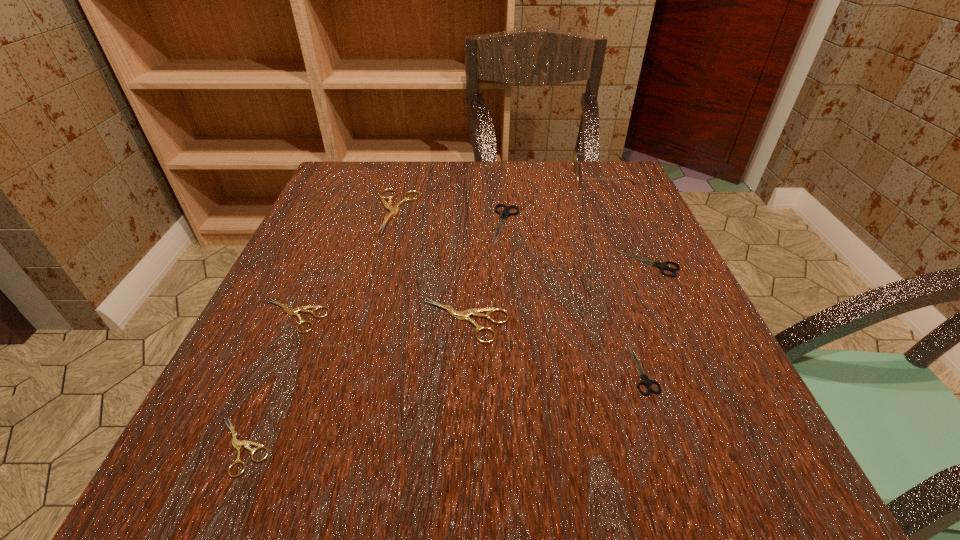
This screenshot has width=960, height=540. In order to click on free space at the far edge in this screenshot , I will do `click(460, 173)`.

Locate an element on the screen. free region at the near edge of the desktop is located at coordinates (583, 446).

I want to click on vacant space at the left edge, so click(300, 334).

Where is `free spot at the right edge of the desktop`? free spot at the right edge of the desktop is located at coordinates click(691, 302).

Where is `blank area at the far left corner`? The image size is (960, 540). blank area at the far left corner is located at coordinates (354, 171).

Identify the location of vacant space at the far right corner. This screenshot has width=960, height=540. (627, 173).

At what (x,y) coordinates should I click in order to perform the action: click on vacant space at the near right corner of the desktop. Please return your answer as a coordinate pair (x, y). The width and height of the screenshot is (960, 540). Looking at the image, I should click on (717, 476).

The image size is (960, 540). Identify the location of free area in between the green sunglasses and the third object from left to right. (499, 194).

Locate an element on the screen. This screenshot has height=540, width=960. free spot between the second nearest black shears and the farthest object is located at coordinates (625, 220).

Find the location of `vacant region between the second beige shears from right to left and the sunglasses`. vacant region between the second beige shears from right to left and the sunglasses is located at coordinates (499, 194).